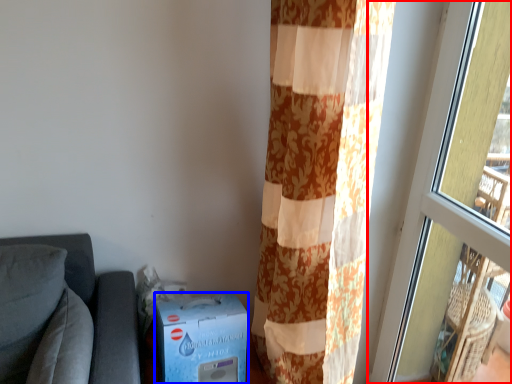
Question: Which object appears farthest to the camera in this image, window (highlighted by a red box) or cardboard box (highlighted by a blue box)?

Choices:
 (A) window
 (B) cardboard box

Answer: (B)